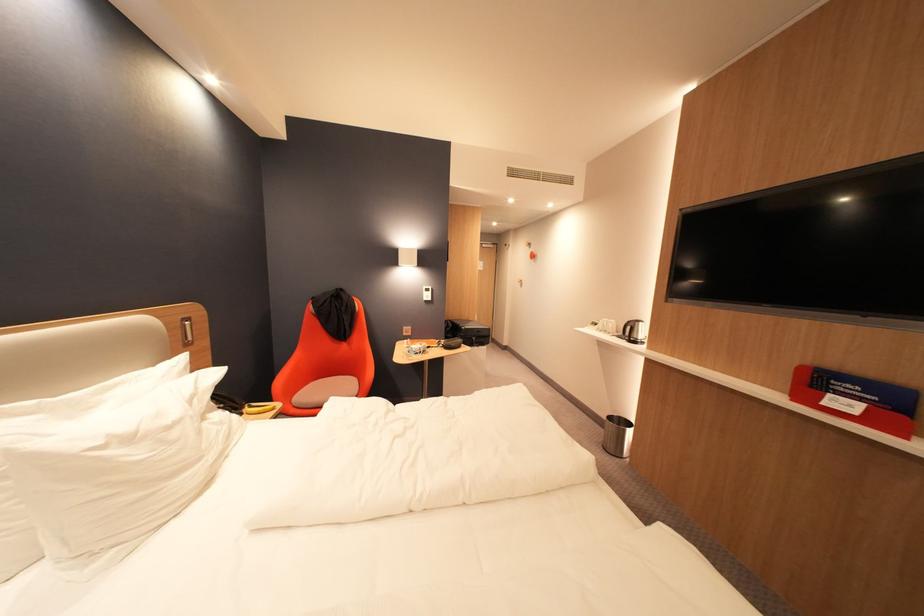
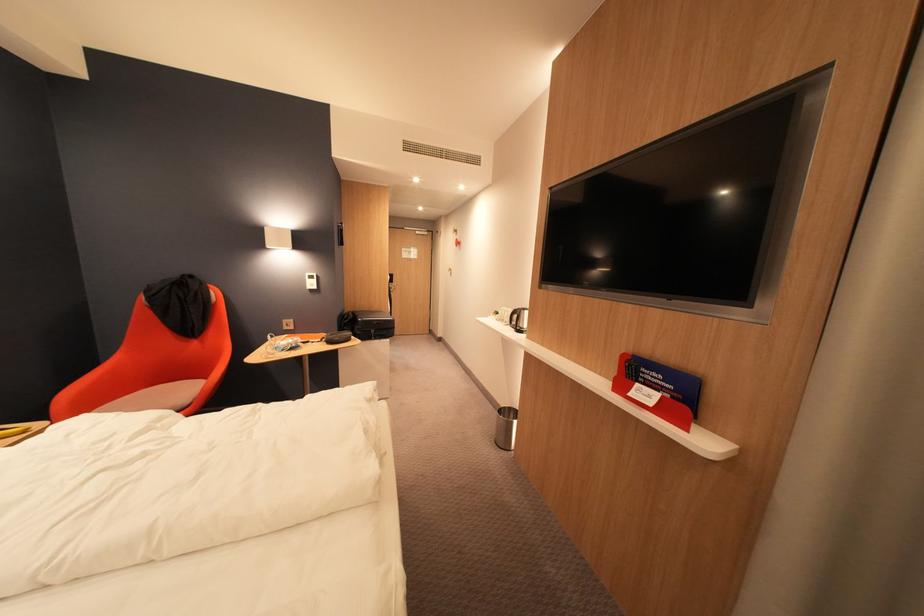
The point at (841, 395) is marked in the first image. Where is the corresponding point in the second image?

(648, 386)